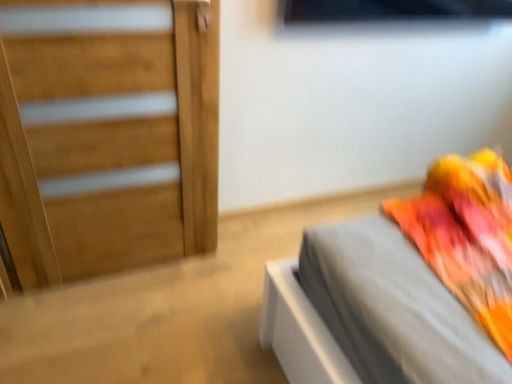
I want to click on vacant space to the right of wooden door at left, so click(x=205, y=302).